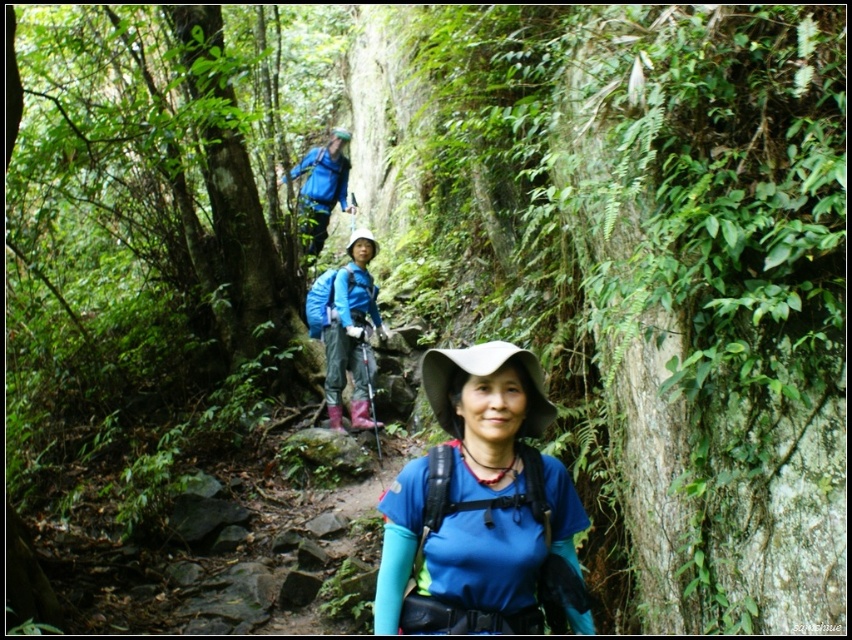
Question: From the image, what is the correct spatial relationship of green rough bark tree at left in relation to blue fabric jacket at center?

Choices:
 (A) left
 (B) right

Answer: (A)

Question: Does green rough bark tree at left appear on the right side of blue fabric jacket at upper center?

Choices:
 (A) no
 (B) yes

Answer: (A)

Question: Which of these objects is positioned closest to the blue fabric shirt at center?

Choices:
 (A) blue fabric jacket at upper center
 (B) green rough bark tree at left
 (C) blue fabric jacket at center

Answer: (C)

Question: Which object is the farthest from the blue fabric shirt at center?

Choices:
 (A) blue fabric jacket at upper center
 (B) green rough bark tree at left

Answer: (A)

Question: Can you confirm if green rough bark tree at left is positioned below blue fabric shirt at center?

Choices:
 (A) no
 (B) yes

Answer: (A)

Question: Considering the real-world distances, which object is closest to the blue fabric shirt at center?

Choices:
 (A) green rough bark tree at left
 (B) blue fabric jacket at upper center

Answer: (A)